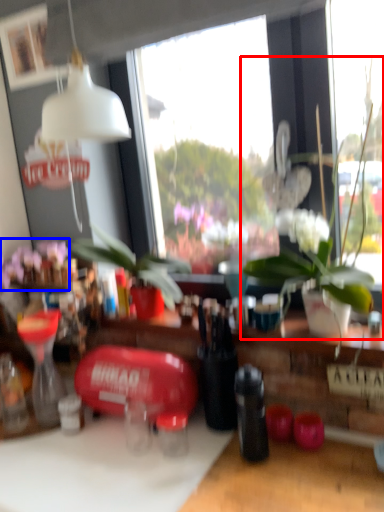
Question: Which object is further to the camera taking this photo, houseplant (highlighted by a red box) or flower (highlighted by a blue box)?

Choices:
 (A) houseplant
 (B) flower

Answer: (B)